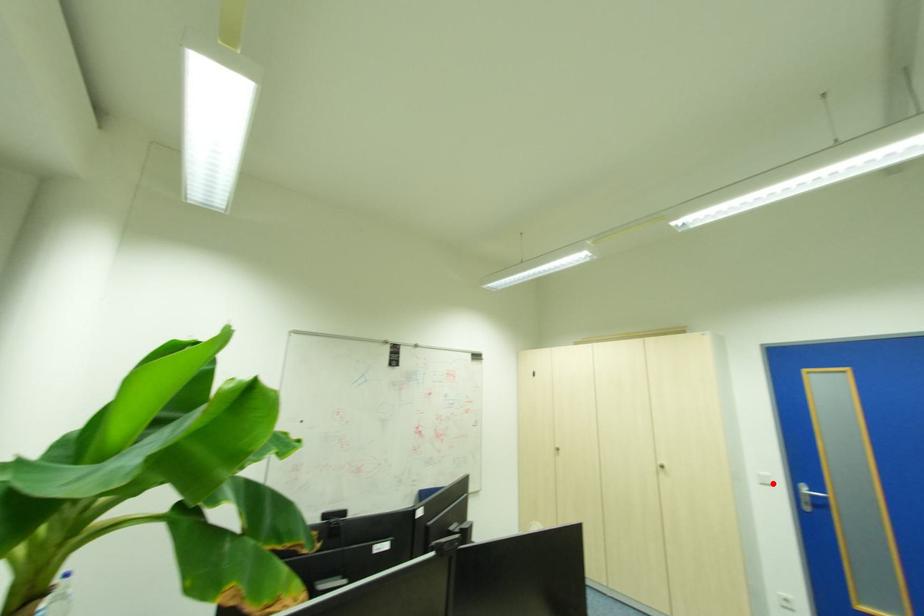
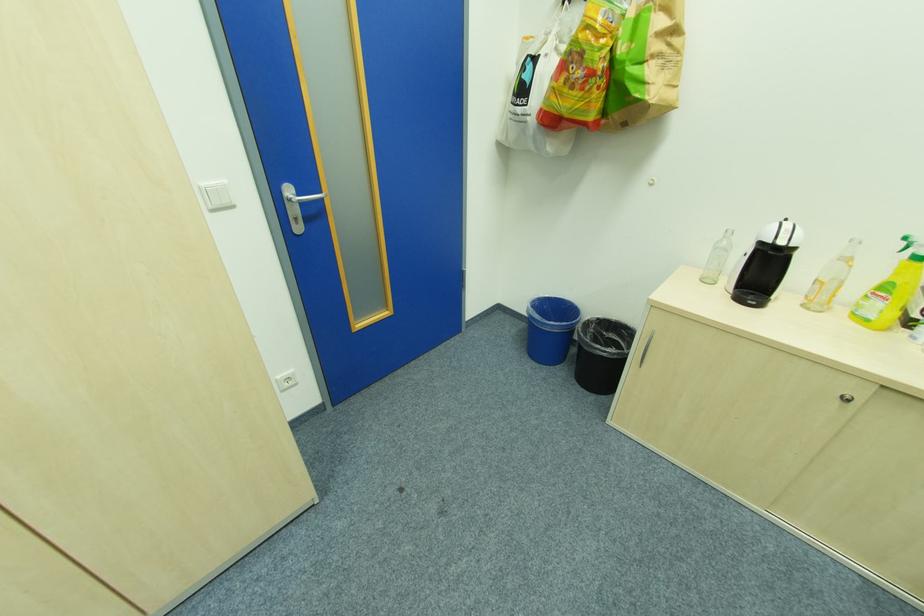
Locate, in the second image, the point that corresponds to the highlighted location in the first image.

(232, 204)